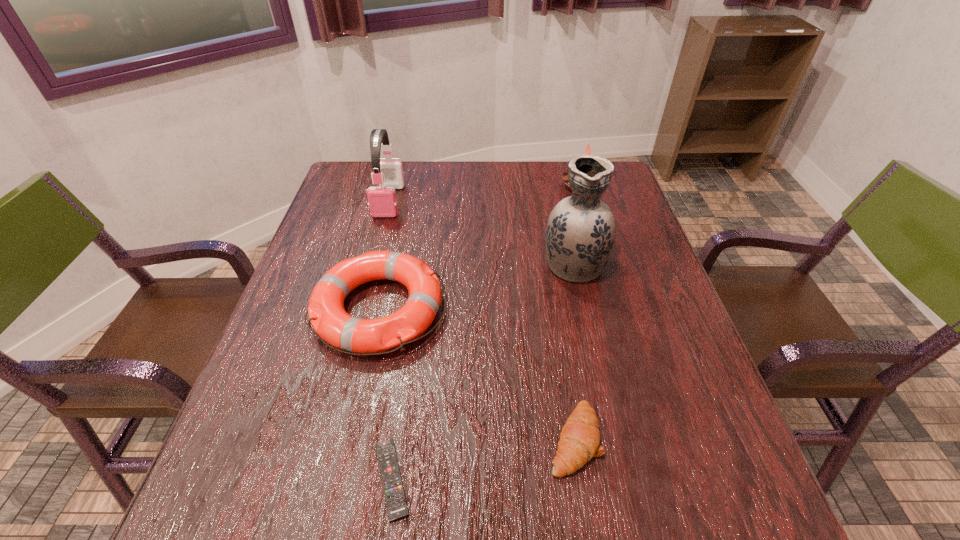
Locate an element on the screen. The width and height of the screenshot is (960, 540). free space located 0.260m on the front of the candle is located at coordinates (602, 253).

Identify the location of free space located on the front of the life buoy. The height and width of the screenshot is (540, 960). (352, 432).

Image resolution: width=960 pixels, height=540 pixels. In order to click on free region located 0.200m on the right of the crescent roll in this screenshot , I will do `click(711, 440)`.

Locate an element on the screen. vacant region located 0.390m on the right of the shortest object is located at coordinates (647, 479).

At what (x,y) coordinates should I click in order to perform the action: click on earphone at the far edge. Please return your answer as a coordinate pair (x, y). Looking at the image, I should click on (382, 201).

Image resolution: width=960 pixels, height=540 pixels. I want to click on candle positioned at the far edge, so click(x=564, y=176).

What are the coordinates of `object present at the near edge` in the screenshot? It's located at (395, 499).

You are a GUI agent. You are given a task and a screenshot of the screen. Output one action in this format:
    pyautogui.click(x=<x>, y=<y>)
    Task: Click on the earphone situated at the left edge
    
    Given the screenshot: What is the action you would take?
    (382, 201)

Locate an element on the screen. Image resolution: width=960 pixels, height=540 pixels. life buoy present at the left edge is located at coordinates (327, 315).

Find the location of a particular element. This screenshot has width=960, height=540. vase that is at the right edge is located at coordinates (580, 233).